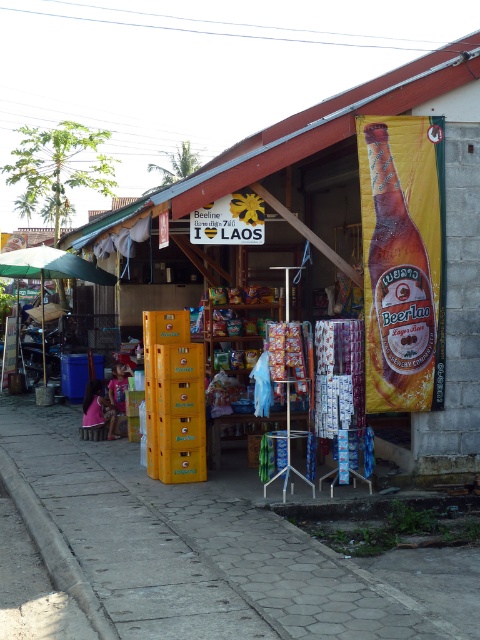
You are standing at the entrance of the shop and want to reach the point marked as point (427, 381). However, there is an obstacle at point (166, 608). Can you walk directly to your destination without going around the obstacle?

Point (166, 608) is in front of point (427, 381), so you cannot walk directly to point (427, 381) without going around the obstacle at point (166, 608).

You are a traveler who wants to buy a bottle of beer from the shop. You have a backpack with a compartment that can only hold items smaller than the golden glass beer bottle at right. Can you fit the yellow plastic crates at center into your backpack?

The yellow plastic crates at center is smaller than the golden glass beer bottle at right. Since the backpack compartment can hold items smaller than the golden glass beer bottle at right, the yellow plastic crates at center can fit into the backpack.